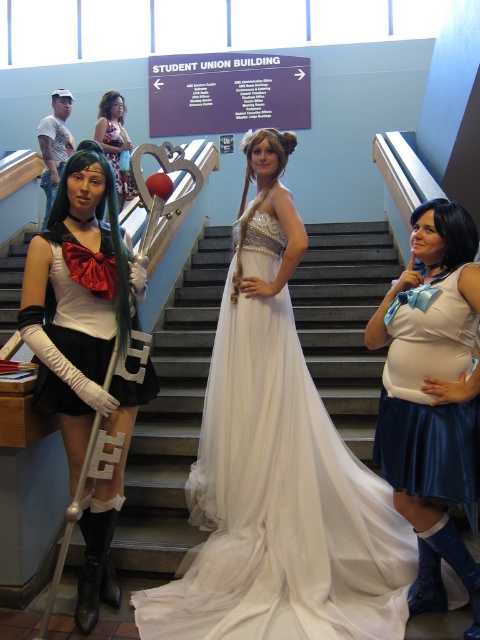
You are standing at the bottom of the staircase in the student union building and see the white satin gown at center. If you want to walk directly towards it, which direction should you move relative to the staircase?

Since the white satin gown at center is located at coordinates point (277, 467), you should move straight ahead up the staircase towards it.

You are a photographer trying to capture a group photo of the matte black cosplay dress at left and the matte white dress at center. Since you want to ensure both are visible in the frame, which dress should you position closer to the camera to maintain their relative sizes as seen in the original scene?

The matte black cosplay dress at left is taller than the matte white dress at center. To maintain their relative sizes in the photo, position the shorter matte white dress at center closer to the camera so that its apparent size matches the taller matte black cosplay dress at left.

You are organizing a photoshoot in the student union building and need to position the matte black cosplay dress at left and the matte white dress at center for a group photo. Given their sizes, which dress requires more horizontal space to avoid being cramped?

The matte black cosplay dress at left requires more horizontal space because its width is larger than the matte white dress at center.